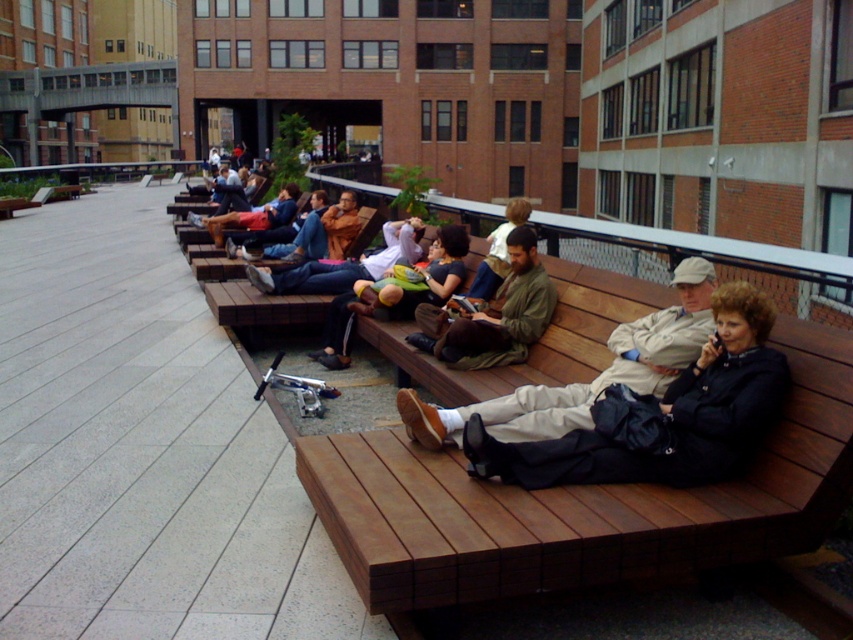
Question: In this image, where is khaki cotton pants at center located relative to blue denim jeans at center?

Choices:
 (A) right
 (B) left

Answer: (A)

Question: Does greenish-brown fabric jacket at center appear over blue denim jeans at center?

Choices:
 (A) yes
 (B) no

Answer: (B)

Question: Which object is closer to the camera taking this photo?

Choices:
 (A) khaki cotton pants at center
 (B) brown wooden bench at center
 (C) blue denim jeans at center

Answer: (B)

Question: Does brown wooden bench at center have a larger size compared to khaki cotton pants at center?

Choices:
 (A) yes
 (B) no

Answer: (A)

Question: Which object is farther from the camera taking this photo?

Choices:
 (A) blue denim jeans at center
 (B) khaki cotton pants at center

Answer: (A)

Question: Which of the following is the farthest from the observer?

Choices:
 (A) (682, 358)
 (B) (541, 310)

Answer: (B)